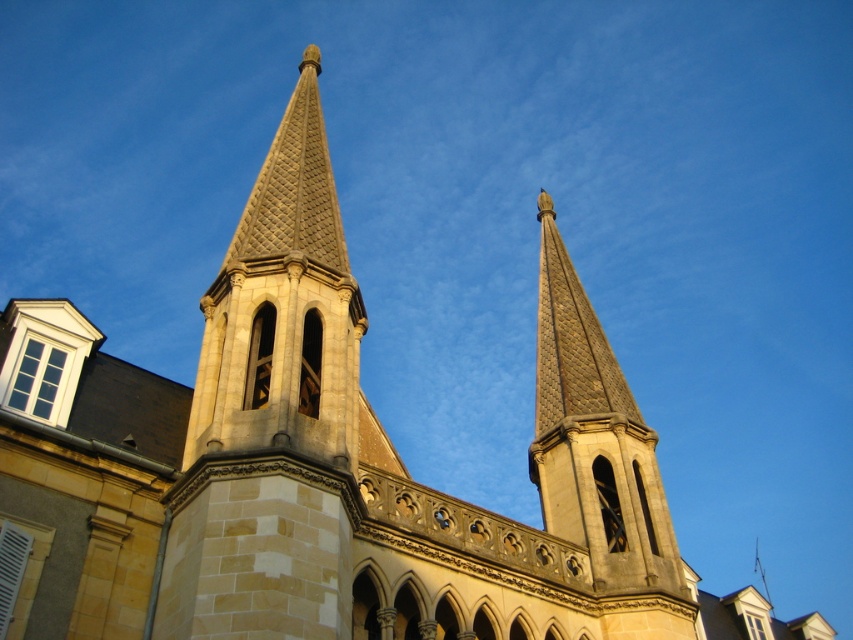
You are an architect analyzing the symmetry of the historic building. The beige stone spire at upper center and the stone spire at center are both part of the structure. Which spire is bigger?

The beige stone spire at upper center is larger in size than the stone spire at center.

You are a drone operator tasked with capturing aerial footage of the historic building. The two spires, beige stone spire at upper center and stone spire at center, are in your camera view. Your drone has a maximum horizontal flight range of 20 meters. Can the drone safely fly between these two spires without exceeding its range?

The distance between the beige stone spire at upper center and the stone spire at center is 19.74 meters. Since the drone has a maximum horizontal flight range of 20 meters, it can safely fly between them without exceeding its range.

You are standing in front of the historic building and want to take a photo of both the beige stone spire at upper center and the stone spire at center. Which spire should you focus on first to ensure both are in the frame?

You should focus on the beige stone stone spire at upper center first because it is closer to you than the stone spire at center, so adjusting the focus from near to far will help capture both in the frame.